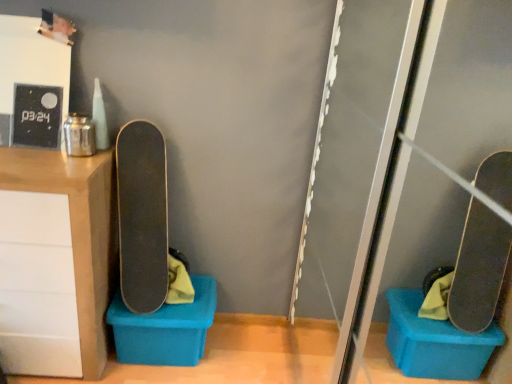
Question: In the image, is matte wood cabinet at left on the left side or the right side of blue plastic storage box at lower left?

Choices:
 (A) right
 (B) left

Answer: (B)

Question: From the image's perspective, relative to blue plastic storage box at lower left, is matte wood cabinet at left above or below?

Choices:
 (A) below
 (B) above

Answer: (B)

Question: Considering the real-world distances, which object is closest to the transparent plastic screen door at right?

Choices:
 (A) blue plastic storage box at lower left
 (B) smooth black skateboard at center
 (C) matte wood cabinet at left

Answer: (A)

Question: Which object is the closest to the transparent plastic screen door at right?

Choices:
 (A) smooth black skateboard at center
 (B) matte wood cabinet at left
 (C) blue plastic storage box at lower left

Answer: (C)